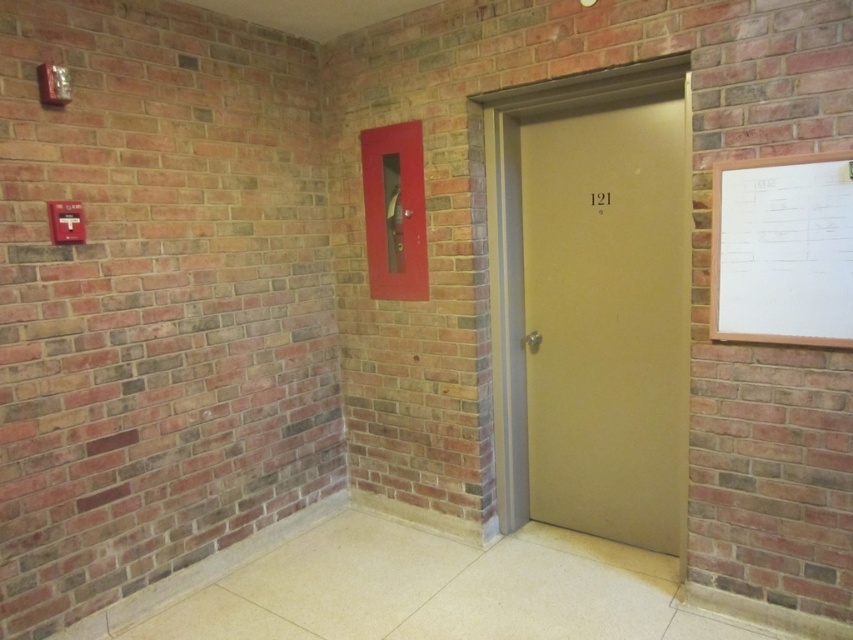
Question: Considering the relative positions of matte beige door at center and metallic red fire extinguisher at center in the image provided, where is matte beige door at center located with respect to metallic red fire extinguisher at center?

Choices:
 (A) left
 (B) right

Answer: (B)

Question: Among these objects, which one is nearest to the camera?

Choices:
 (A) metallic red fire extinguisher at center
 (B) white wooden board at upper right
 (C) matte beige door at center

Answer: (B)

Question: Which object is positioned closest to the white wooden board at upper right?

Choices:
 (A) matte beige door at center
 (B) metallic red fire extinguisher at center

Answer: (A)

Question: Does matte beige door at center appear over metallic red fire extinguisher at center?

Choices:
 (A) no
 (B) yes

Answer: (A)

Question: Estimate the real-world distances between objects in this image. Which object is closer to the metallic red fire extinguisher at center?

Choices:
 (A) white wooden board at upper right
 (B) matte beige door at center

Answer: (B)

Question: Considering the relative positions of matte beige door at center and white wooden board at upper right in the image provided, where is matte beige door at center located with respect to white wooden board at upper right?

Choices:
 (A) above
 (B) below

Answer: (B)